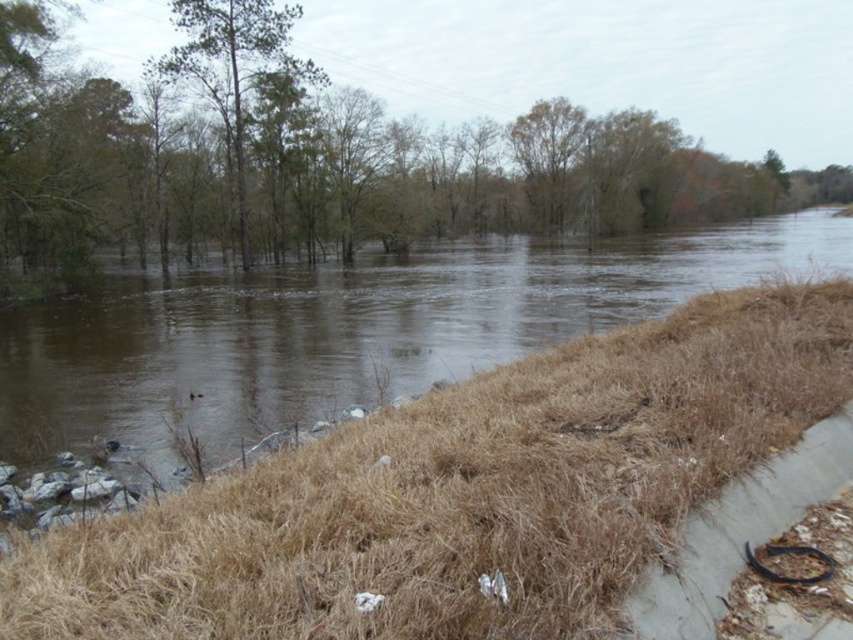
Describe the element at coordinates (737, 532) in the screenshot. The width and height of the screenshot is (853, 640). I see `gray concrete curb at lower right` at that location.

In the scene shown: Between gray concrete curb at lower right and brown leafy tree at upper center, which one has more height?

brown leafy tree at upper center is taller.

Is point (698, 536) positioned before point (554, 205)?

Yes, point (698, 536) is in front of point (554, 205).

Identify the location of gray concrete curb at lower right. (737, 532).

Is brown muddy water at center wider than gray concrete curb at lower right?

Yes, brown muddy water at center is wider than gray concrete curb at lower right.

Is brown muddy water at center to the left of gray concrete curb at lower right from the viewer's perspective?

No, brown muddy water at center is not to the left of gray concrete curb at lower right.

This screenshot has height=640, width=853. Find the location of `brown muddy water at center`. brown muddy water at center is located at coordinates (347, 332).

Can you confirm if green leafy tree at upper center is positioned below gray concrete curb at lower right?

Incorrect, green leafy tree at upper center is not positioned below gray concrete curb at lower right.

From the picture: Does green leafy tree at upper center come behind gray concrete curb at lower right?

Yes, it is behind gray concrete curb at lower right.

This screenshot has width=853, height=640. In order to click on green leafy tree at upper center in this screenshot , I will do `click(315, 157)`.